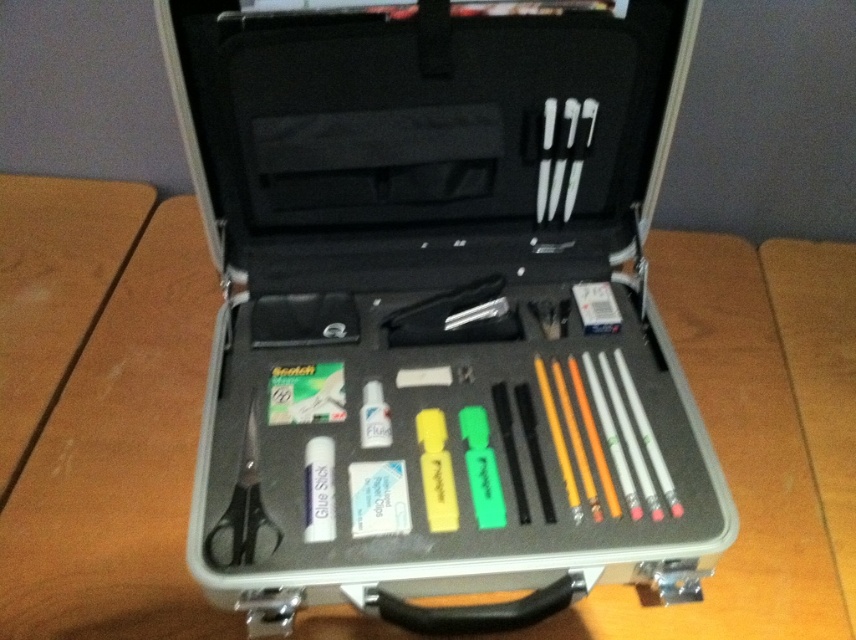
Question: Which point is farther from the camera taking this photo?

Choices:
 (A) (550, 310)
 (B) (235, 532)
 (C) (266, 243)
 (D) (563, 125)

Answer: (A)

Question: From the image, what is the correct spatial relationship of black plastic scissors at left in relation to white plastic eraser at center?

Choices:
 (A) above
 (B) below

Answer: (B)

Question: Which of the following is the farthest from the observer?

Choices:
 (A) (544, 177)
 (B) (251, 412)
 (C) (672, 28)

Answer: (A)

Question: Which point is closer to the camera?

Choices:
 (A) (559, 336)
 (B) (429, 524)
 (C) (584, 122)
 (D) (259, 470)

Answer: (B)

Question: Does silver metallic briefcase at center lie in front of black plastic scissors at left?

Choices:
 (A) yes
 (B) no

Answer: (A)

Question: Does silver metallic briefcase at center have a lesser width compared to black plastic scissors at left?

Choices:
 (A) no
 (B) yes

Answer: (A)